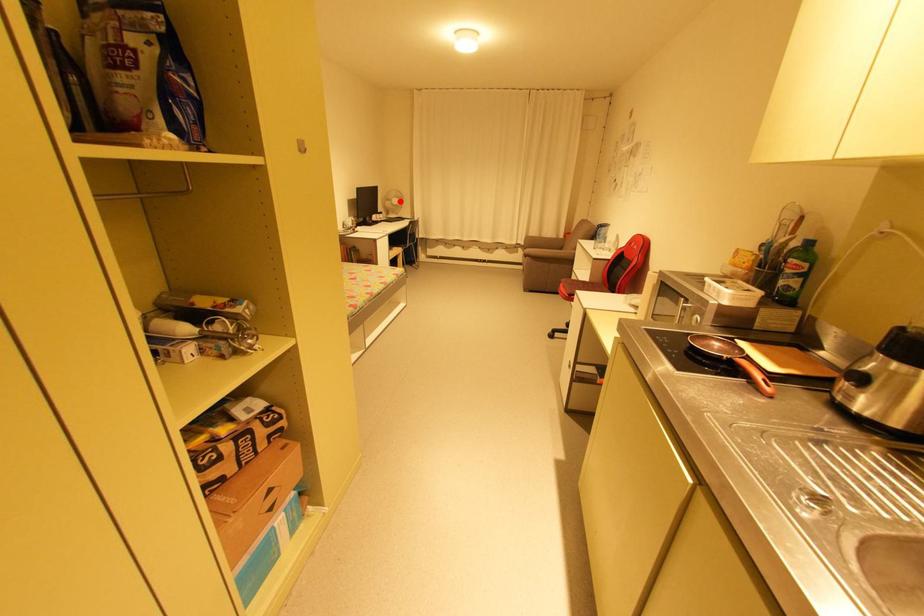
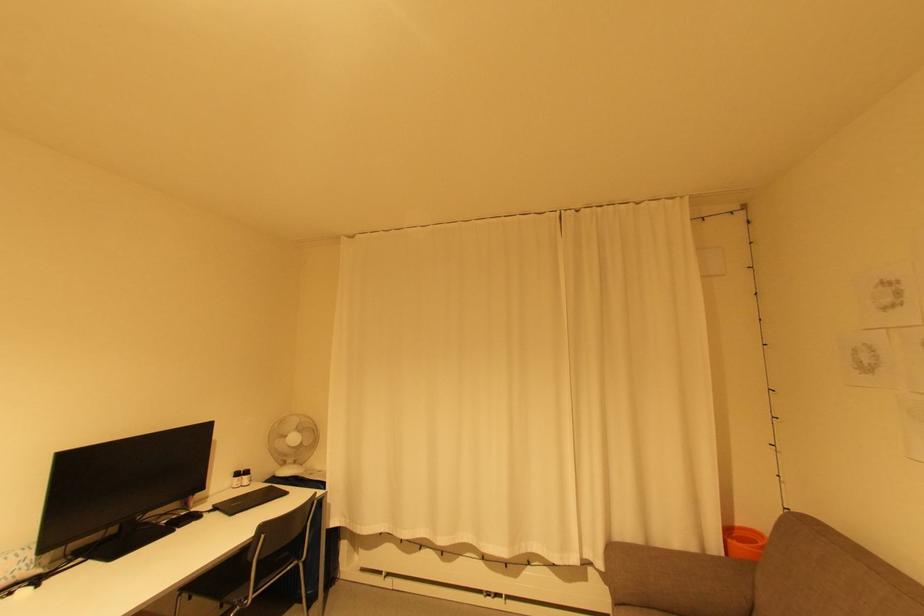
The point at the highlighted location is marked in the first image. Where is the corresponding point in the second image?

(298, 439)